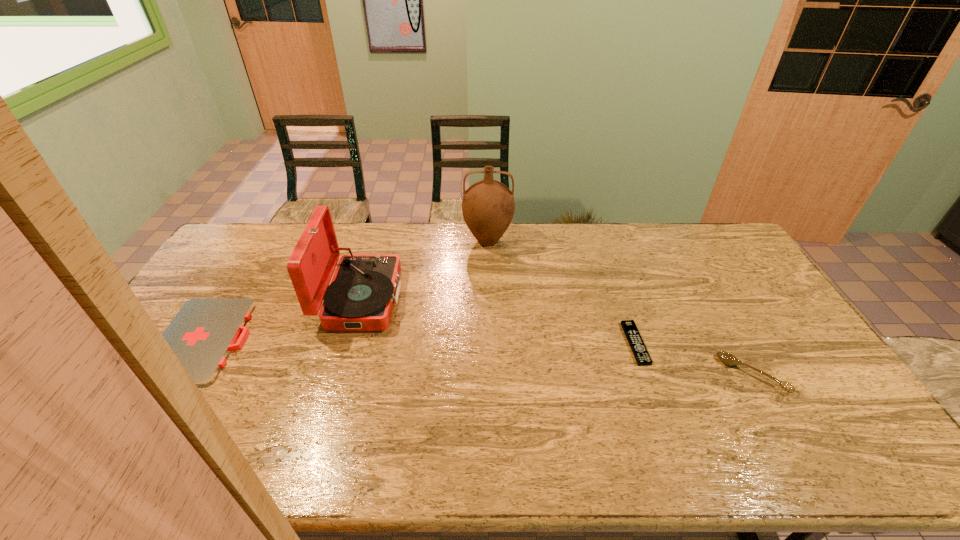
This screenshot has height=540, width=960. Find the location of `vacant point located 0.260m on the front-facing side of the second object from left to right`. vacant point located 0.260m on the front-facing side of the second object from left to right is located at coordinates (479, 299).

Locate an element on the screen. Image resolution: width=960 pixels, height=540 pixels. vacant space located on the left of the ladle is located at coordinates (662, 374).

You are a GUI agent. You are given a task and a screenshot of the screen. Output one action in this format:
    pyautogui.click(x=<x>, y=<y>)
    Task: Click on the free space located 0.090m on handle side the first-aid kit
    Image resolution: width=960 pixels, height=540 pixels.
    Given the screenshot: What is the action you would take?
    pyautogui.click(x=276, y=340)

Locate an element on the screen. blank space located 0.210m on the right of the remote control is located at coordinates (715, 343).

Locate an element on the screen. object located at the far edge is located at coordinates (488, 206).

Image resolution: width=960 pixels, height=540 pixels. Find the location of `object that is positioned at the left edge`. object that is positioned at the left edge is located at coordinates (203, 333).

Find the location of `object at the right edge`. object at the right edge is located at coordinates (727, 358).

Find the location of a particular element. This screenshot has width=960, height=540. vacant point at the far edge is located at coordinates (439, 245).

At what (x,y) coordinates should I click in order to perform the action: click on free space at the near edge of the desktop. Please return your answer as a coordinate pair (x, y). This screenshot has height=540, width=960. Looking at the image, I should click on (202, 452).

In the image, there is a desktop. Identify the location of free space at the left edge. (239, 260).